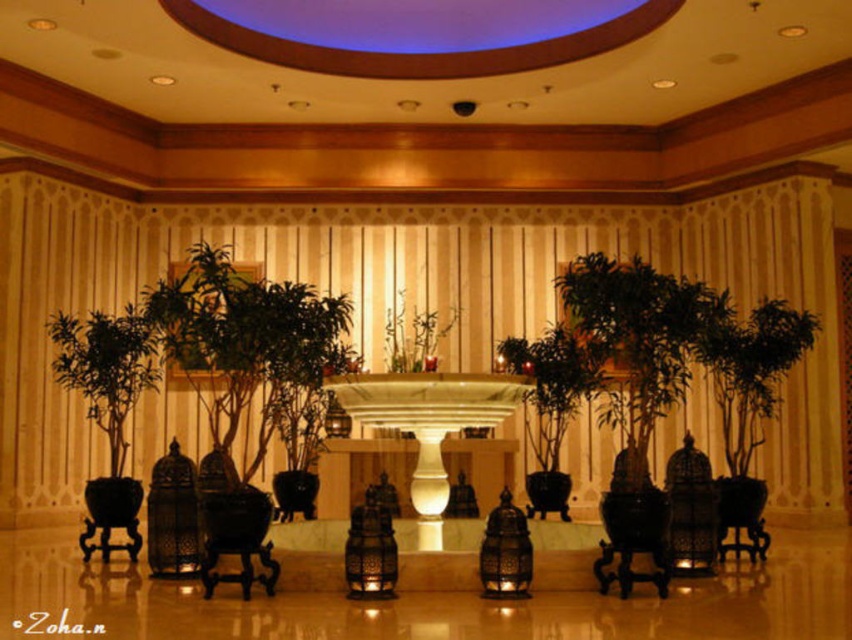
Question: Is green matte plant at left bigger than black polished wood armchair at center?

Choices:
 (A) no
 (B) yes

Answer: (B)

Question: Can you confirm if metallic ornate lantern at center is positioned above green matte vase at center?

Choices:
 (A) no
 (B) yes

Answer: (A)

Question: Which point is closer to the camera?

Choices:
 (A) (140, 314)
 (B) (204, 525)
 (C) (698, 500)
 (D) (406, 339)

Answer: (B)

Question: Can you confirm if black polished wood armchair at center is bigger than metallic ornate lantern at center?

Choices:
 (A) yes
 (B) no

Answer: (A)

Question: Among these points, which one is nearest to the camera?

Choices:
 (A) (217, 451)
 (B) (430, 353)
 (C) (700, 557)

Answer: (A)

Question: Estimate the real-world distances between objects in this image. Which object is farther from the green matte plant at left?

Choices:
 (A) green matte vase at center
 (B) black polished wood armchair at center

Answer: (A)